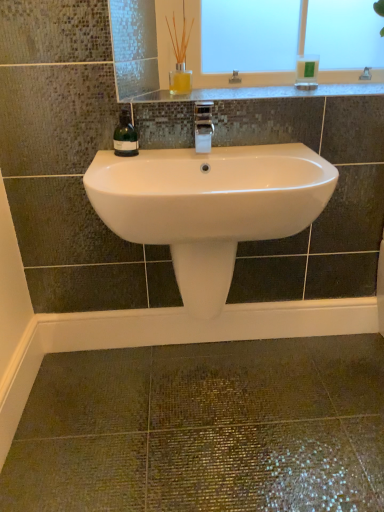
Question: Does green plastic soap dispenser at upper right appear on the right side of white glossy sink at center?

Choices:
 (A) no
 (B) yes

Answer: (B)

Question: Does green plastic soap dispenser at upper right turn towards white glossy sink at center?

Choices:
 (A) yes
 (B) no

Answer: (B)

Question: Is green plastic soap dispenser at upper right thinner than white glossy sink at center?

Choices:
 (A) yes
 (B) no

Answer: (A)

Question: From a real-world perspective, is green plastic soap dispenser at upper right located higher than white glossy sink at center?

Choices:
 (A) no
 (B) yes

Answer: (B)

Question: Is green plastic soap dispenser at upper right at the left side of white glossy sink at center?

Choices:
 (A) no
 (B) yes

Answer: (A)

Question: Which is correct: translucent glass vase at upper center is inside green plastic soap dispenser at upper right, or outside of it?

Choices:
 (A) inside
 (B) outside

Answer: (B)

Question: In terms of width, does translucent glass vase at upper center look wider or thinner when compared to green plastic soap dispenser at upper right?

Choices:
 (A) thin
 (B) wide

Answer: (B)

Question: Based on their sizes in the image, would you say translucent glass vase at upper center is bigger or smaller than green plastic soap dispenser at upper right?

Choices:
 (A) big
 (B) small

Answer: (A)

Question: From the image's perspective, is translucent glass vase at upper center positioned above or below green plastic soap dispenser at upper right?

Choices:
 (A) above
 (B) below

Answer: (A)

Question: Is green plastic soap dispenser at upper right bigger or smaller than white ceramic faucet at center?

Choices:
 (A) small
 (B) big

Answer: (A)

Question: Does point (296, 73) appear closer or farther from the camera than point (203, 143)?

Choices:
 (A) farther
 (B) closer

Answer: (A)

Question: Is green plastic soap dispenser at upper right inside or outside of white ceramic faucet at center?

Choices:
 (A) outside
 (B) inside

Answer: (A)

Question: Considering the positions of green plastic soap dispenser at upper right and white ceramic faucet at center in the image, is green plastic soap dispenser at upper right wider or thinner than white ceramic faucet at center?

Choices:
 (A) thin
 (B) wide

Answer: (A)

Question: Is granite countertop at upper center to the left or to the right of translucent glass vase at upper center in the image?

Choices:
 (A) right
 (B) left

Answer: (A)

Question: In terms of size, does granite countertop at upper center appear bigger or smaller than translucent glass vase at upper center?

Choices:
 (A) small
 (B) big

Answer: (B)